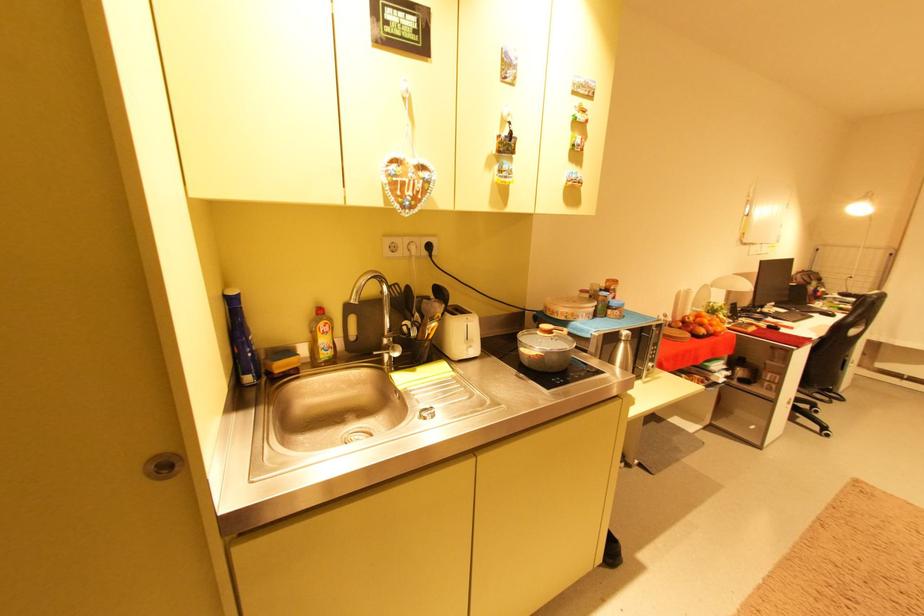
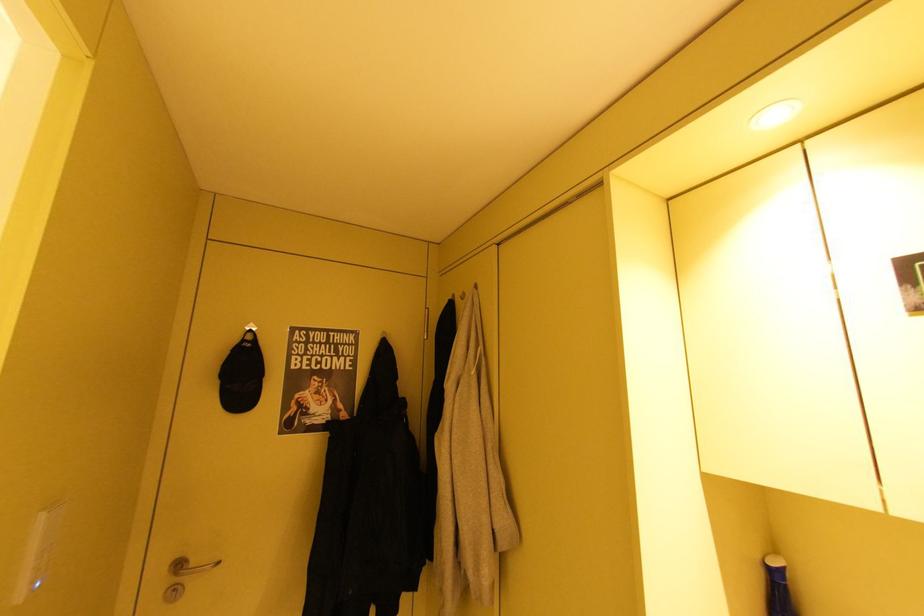
Question: Based on the continuous images, in which direction is the camera rotating? Reply with the corresponding letter.

Choices:
 (A) Left
 (B) Right
 (C) Up
 (D) Down

Answer: (A)